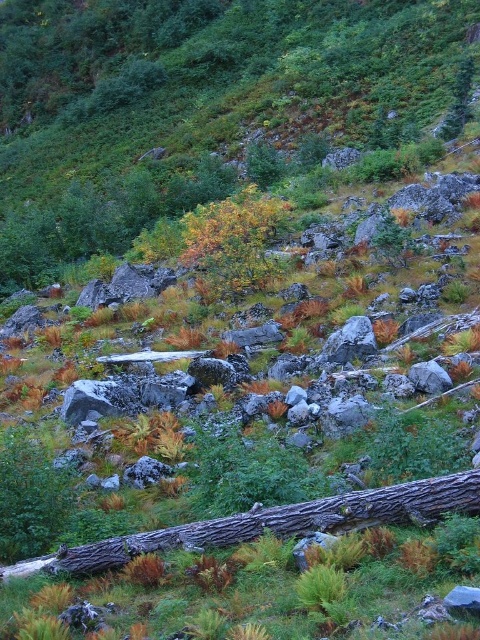
Between yellow-green foliage at center and green matte tree at upper center, which one appears on the left side from the viewer's perspective?

yellow-green foliage at center

Measure the distance from yellow-green foliage at center to green matte tree at upper center.

A distance of 12.98 meters exists between yellow-green foliage at center and green matte tree at upper center.

You are a GUI agent. You are given a task and a screenshot of the screen. Output one action in this format:
    pyautogui.click(x=<x>, y=<y>)
    Task: Click on the yellow-green foliage at center
    The width and height of the screenshot is (480, 640).
    Given the screenshot: What is the action you would take?
    pyautogui.click(x=233, y=241)

Which is behind, point (200, 548) or point (226, 252)?

The point (226, 252) is behind.

Can you confirm if rough bark log at center is taller than yellow-green foliage at center?

No, rough bark log at center is not taller than yellow-green foliage at center.

Is point (179, 534) farther from camera compared to point (206, 214)?

No, (179, 534) is in front of (206, 214).

I want to click on rough bark log at center, so [x=287, y=522].

Is rough bark log at center thinner than green matte tree at upper center?

No, rough bark log at center is not thinner than green matte tree at upper center.

Describe the element at coordinates (287, 522) in the screenshot. The image size is (480, 640). I see `rough bark log at center` at that location.

Which is behind, point (144, 540) or point (443, 120)?

Positioned behind is point (443, 120).

The image size is (480, 640). In order to click on rough bark log at center in this screenshot , I will do `click(287, 522)`.